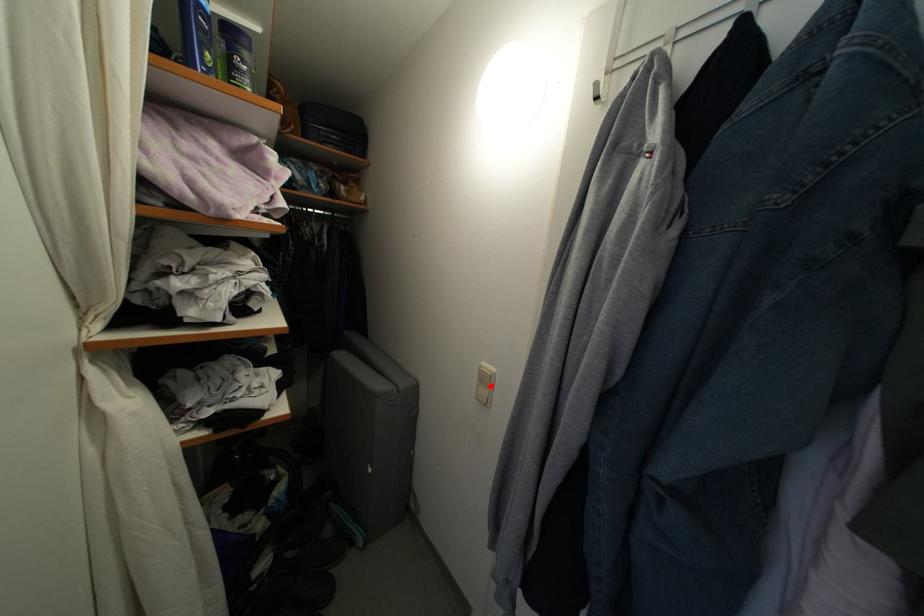
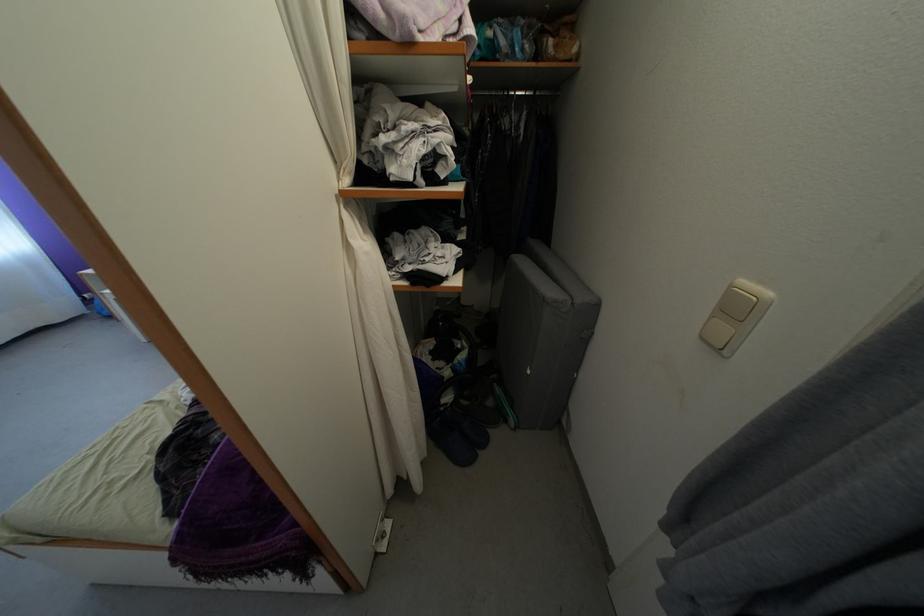
Locate, in the second image, the point that corresponds to the highlighted location in the first image.

(743, 315)